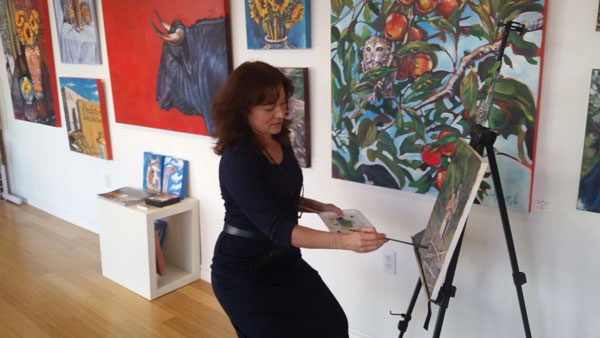
Find the location of a particular element. This screenshot has height=338, width=600. floor is located at coordinates (102, 291).